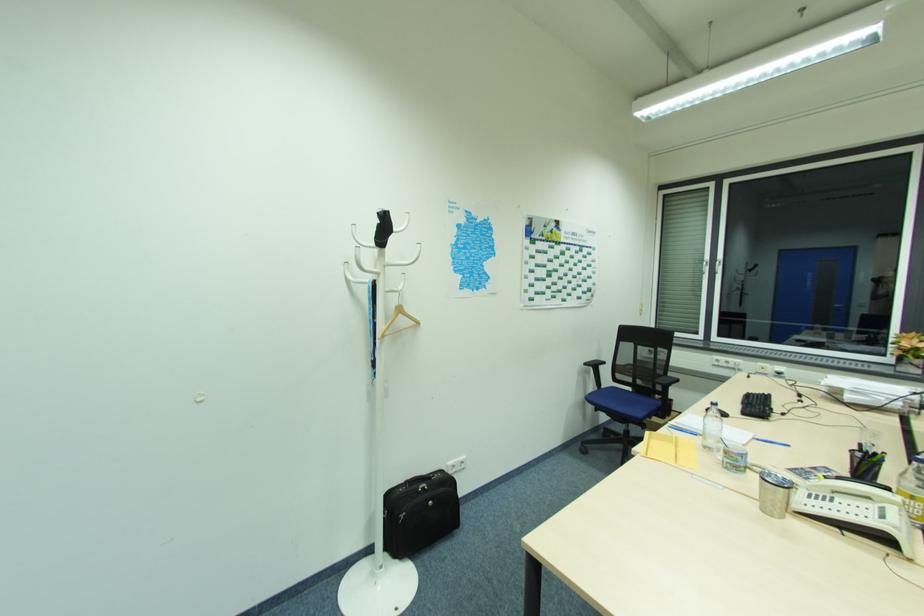
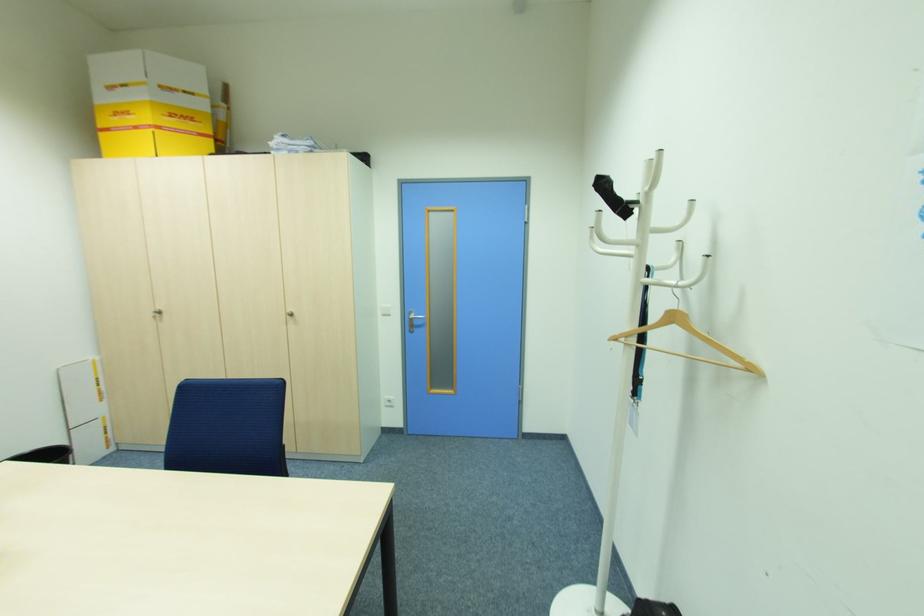
Find the pixel in the second image that matches point (420, 323) in the first image.

(756, 370)